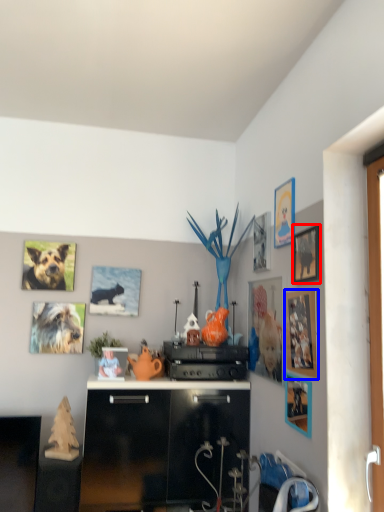
Question: Which of the following is the farthest to the observer, picture frame (highlighted by a red box) or picture frame (highlighted by a blue box)?

Choices:
 (A) picture frame
 (B) picture frame

Answer: (A)